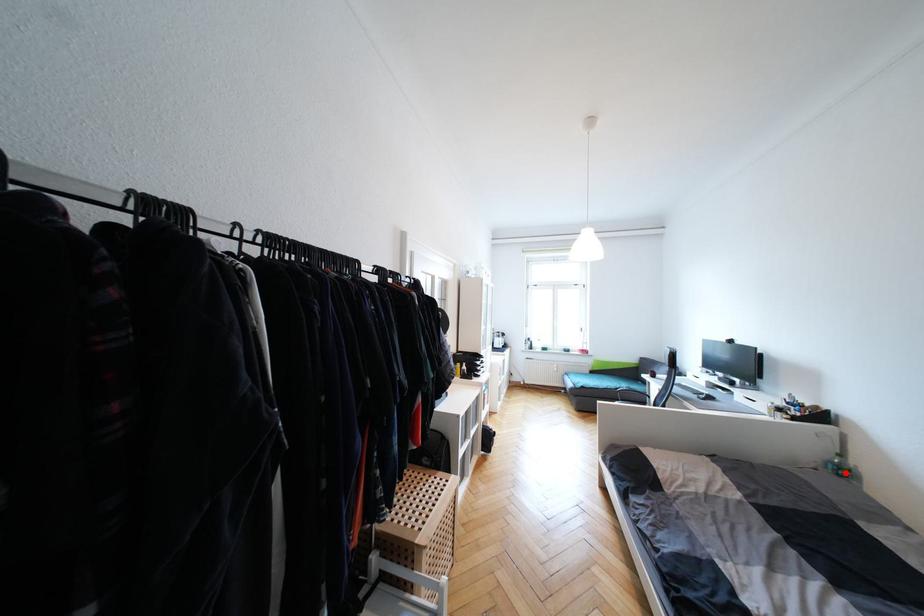
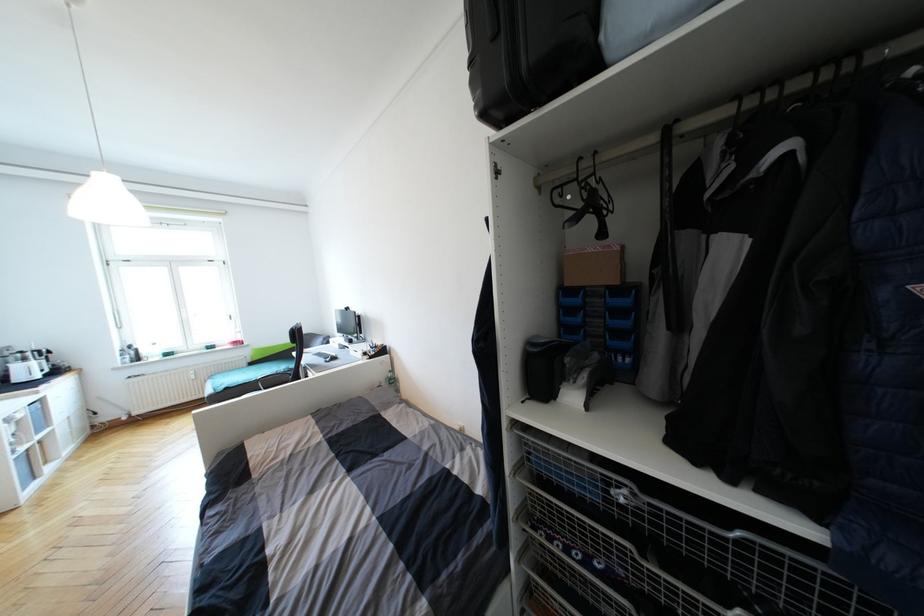
Question: I am providing you with two images of the same scene from different viewpoints. Image1 has a red point marked. In image2, the corresponding 3D location appears at what relative position? Reply with the corresponding letter.

Choices:
 (A) Closer
 (B) Farther

Answer: (B)